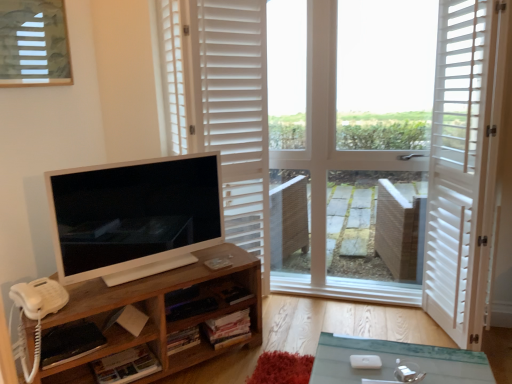
Question: In terms of width, does matte glass window at upper left look wider or thinner when compared to woodenobject at left?

Choices:
 (A) wide
 (B) thin

Answer: (B)

Question: In the image, is matte glass window at upper left positioned in front of or behind woodenobject at left?

Choices:
 (A) front
 (B) behind

Answer: (B)

Question: Which is nearer to the woodenobject at left?

Choices:
 (A) matte glass window at upper left
 (B) satin white monitor at left
 (C) white wooden screen door at right
 (D) white matte shutters at upper center

Answer: (B)

Question: Estimate the real-world distances between objects in this image. Which object is farther from the woodenobject at left?

Choices:
 (A) matte glass window at upper left
 (B) white wooden screen door at right
 (C) satin white monitor at left
 (D) white matte shutters at upper center

Answer: (B)